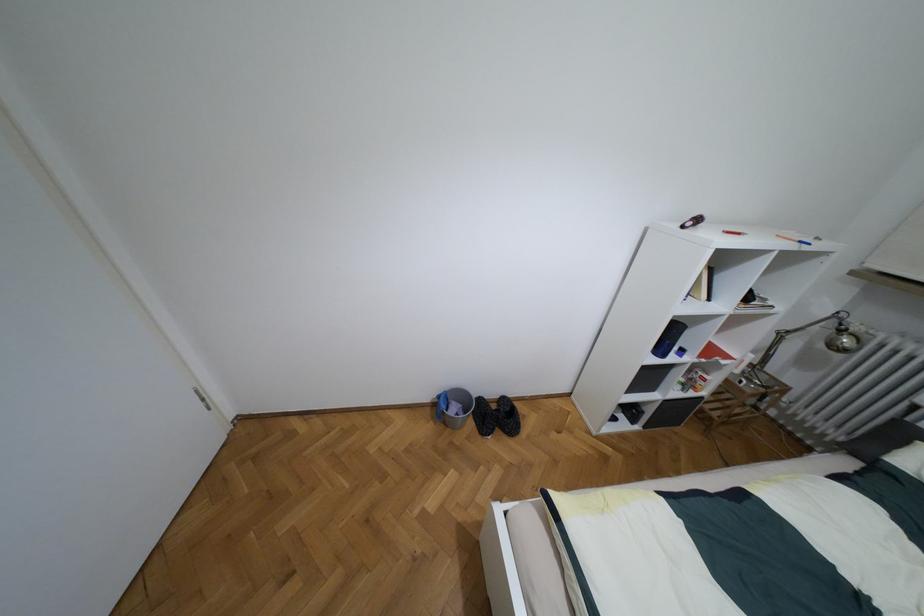
Find where to adjust the silver lamp arm. Please return your answer as a coordinate pair (x, y).

(801, 326)